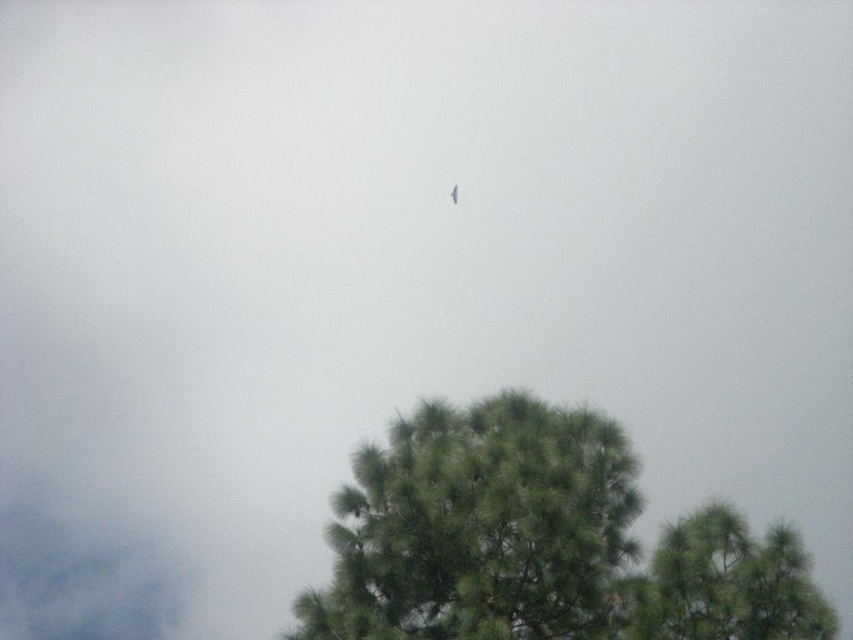
You are standing at point A located at point (373,531). You want to walk to point B, which is 27.89 meters away. Is the path between them clear of any obstacles like trees or other objects?

The path between point A located at point (373,531) and point B is 27.89 meters apart. Since the scene only mentions two pine trees in the foreground and no other obstacles, the path is likely clear except for the two pine trees. However, their exact positions relative to the path aren

You are a bird flying between the green fuzzy tree at center and the gray fluffy cloud at upper left. Which object is wider from your perspective?

The green fuzzy tree at center might be wider than the gray fluffy cloud at upper left, so the green fuzzy tree at center appears wider from the bird perspective.